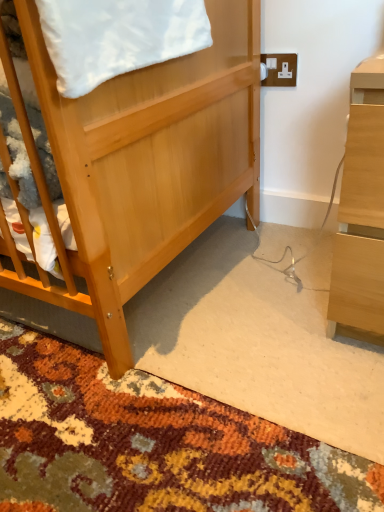
Identify the location of free space behind light wood desk at right. Image resolution: width=384 pixels, height=512 pixels. (285, 242).